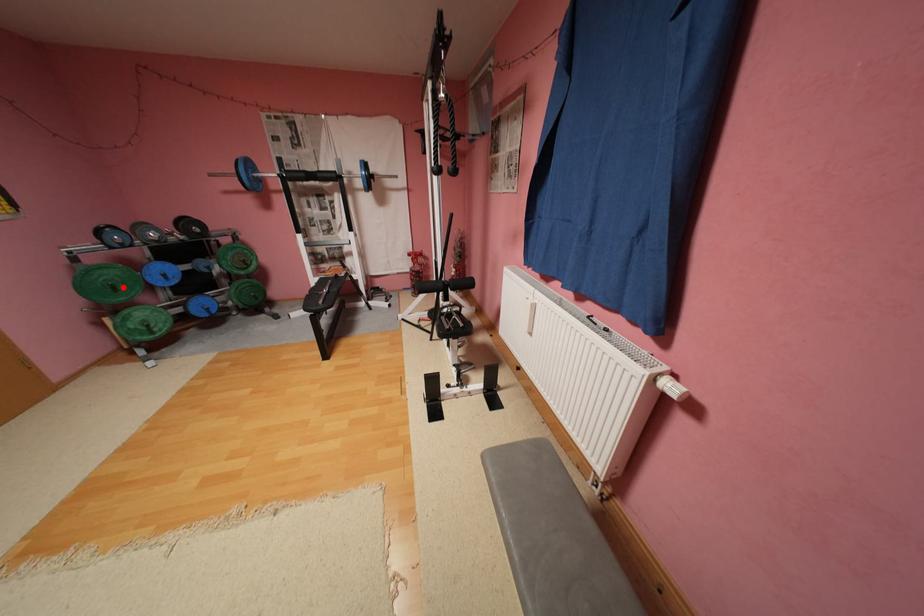
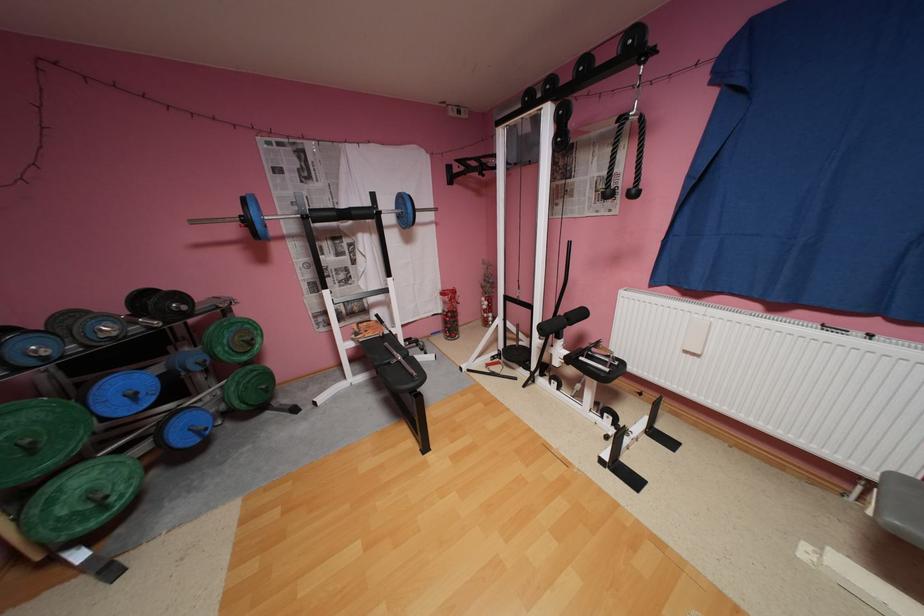
The point at the highlighted location is marked in the first image. Where is the corresponding point in the second image?

(40, 448)